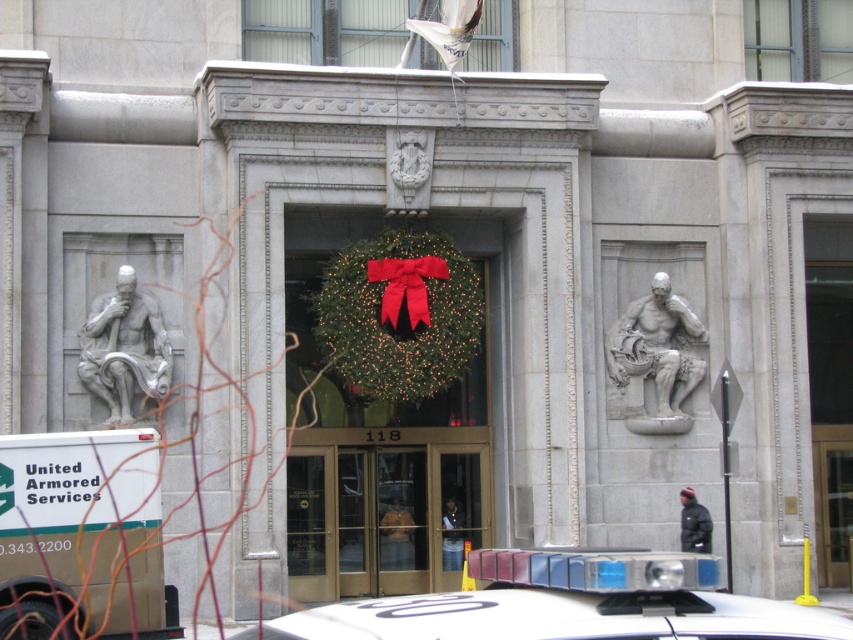
Is white plastic car at center shorter than gray stone sculpture at left?

No, white plastic car at center is not shorter than gray stone sculpture at left.

Does white plastic car at center come in front of gray stone sculpture at left?

Yes, it is.

Which is in front, point (676, 604) or point (165, 349)?

Point (676, 604)

Find the location of a particular element. white plastic car at center is located at coordinates (566, 604).

Which is more to the right, glass door at center or gray stone sculpture at left?

Positioned to the right is glass door at center.

Who is more distant from viewer, (x=401, y=584) or (x=134, y=273)?

Positioned behind is point (x=401, y=584).

This screenshot has width=853, height=640. Identify the location of glass door at center. (381, 516).

Between green textured wreath at center and gray stone sculpture at left, which one appears on the left side from the viewer's perspective?

Positioned to the left is gray stone sculpture at left.

How far apart are green textured wreath at center and gray stone sculpture at left?

green textured wreath at center is 2.66 meters from gray stone sculpture at left.

Who is more forward, (312, 301) or (79, 365)?

Point (79, 365) is more forward.

The image size is (853, 640). Identify the location of green textured wreath at center. (398, 316).